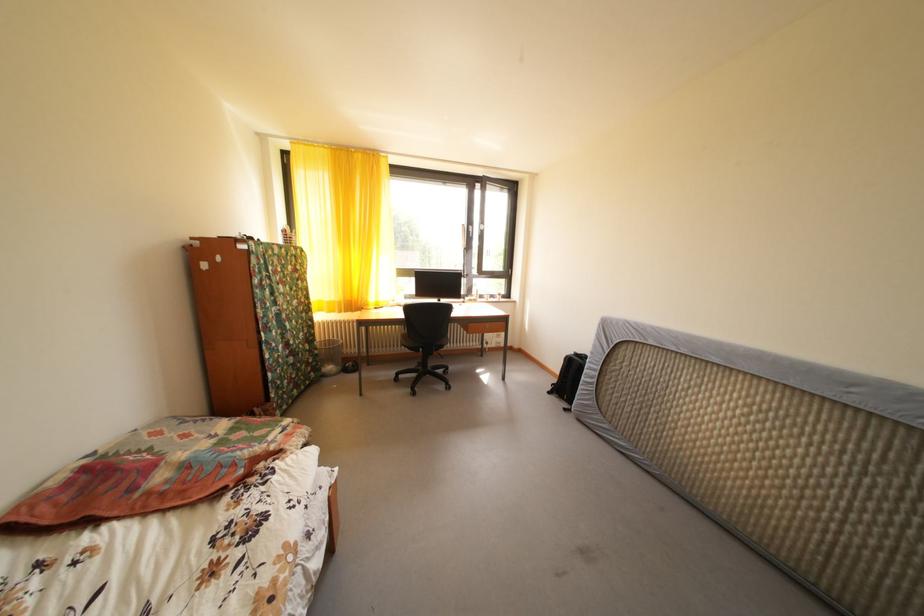
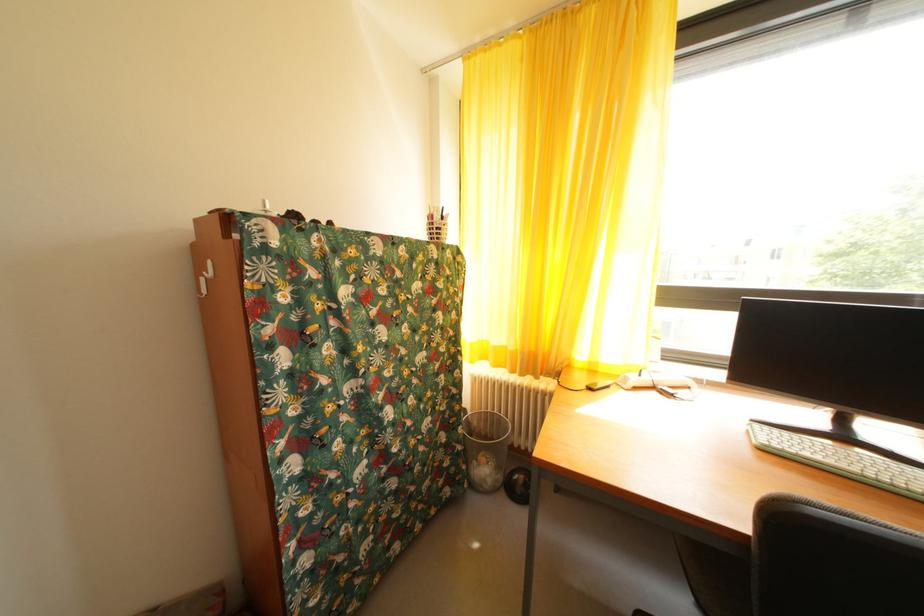
Where in the second image is the point corresponding to [325,358] from the first image?

(468, 454)